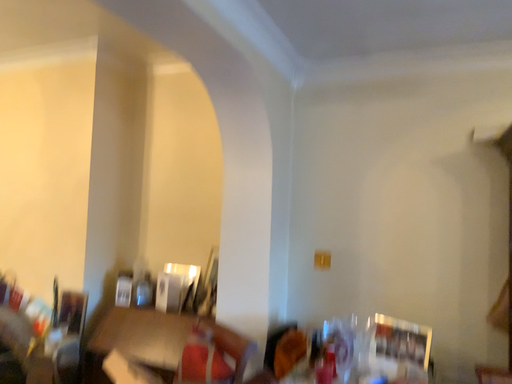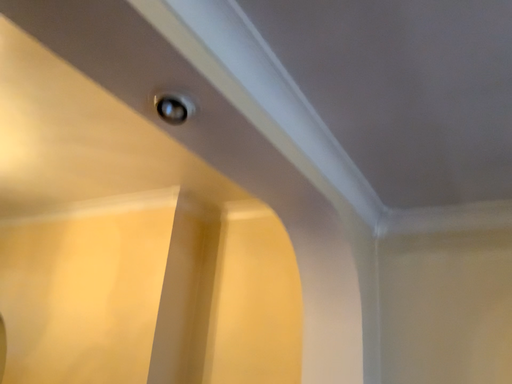
Question: Which way did the camera rotate in the video?

Choices:
 (A) rotated right
 (B) rotated left

Answer: (B)